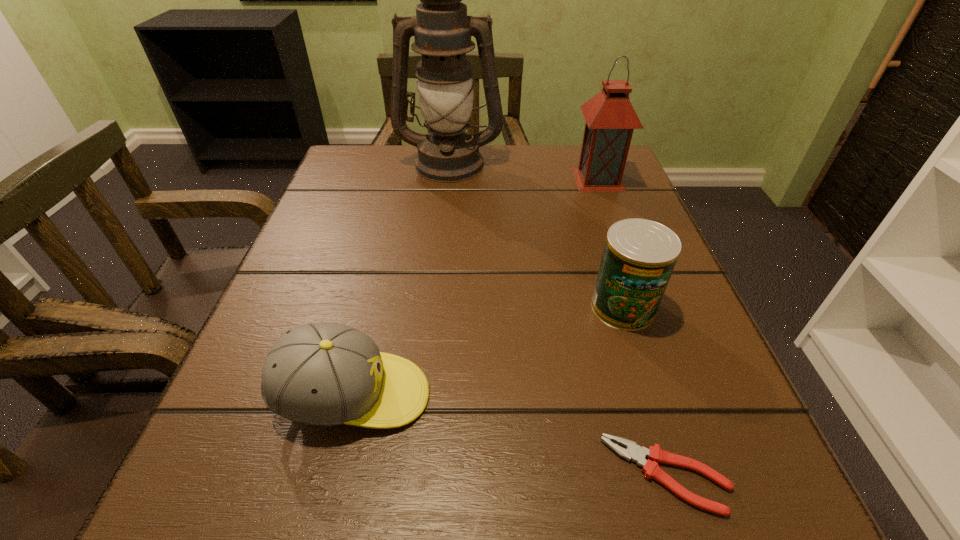
Find the location of `object at the far right corner`. object at the far right corner is located at coordinates (610, 118).

In order to click on object present at the near right corner in this screenshot , I will do `click(636, 453)`.

Where is `free space at the near edge of the desktop`? free space at the near edge of the desktop is located at coordinates (581, 525).

At what (x,y) coordinates should I click in order to perform the action: click on vacant area at the left edge. Please return your answer as a coordinate pair (x, y). Image resolution: width=960 pixels, height=540 pixels. Looking at the image, I should click on (271, 312).

This screenshot has height=540, width=960. Find the location of `vacant area at the right edge of the desktop`. vacant area at the right edge of the desktop is located at coordinates (594, 255).

Where is `vacant space at the far left corner`? The image size is (960, 540). vacant space at the far left corner is located at coordinates (376, 170).

I want to click on blank space at the far right corner, so click(568, 148).

This screenshot has width=960, height=540. Find the location of `free space at the near right corner of the desktop`. free space at the near right corner of the desktop is located at coordinates (721, 468).

The height and width of the screenshot is (540, 960). In order to click on vacant space in between the pliers and the baseball cap in this screenshot , I will do `click(510, 435)`.

Locate an element on the screen. The width and height of the screenshot is (960, 540). vacant space that is in between the third farthest object and the oil lamp is located at coordinates (537, 235).